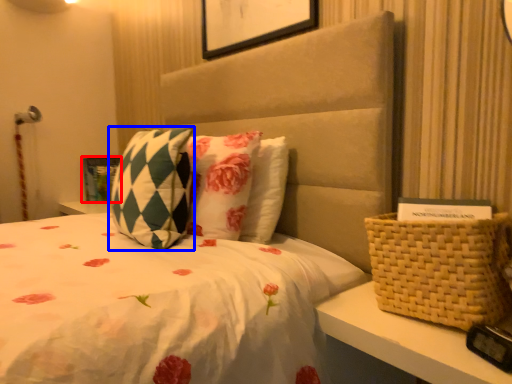
Question: Which of the following is the farthest to the observer, picture frame (highlighted by a red box) or pillow (highlighted by a blue box)?

Choices:
 (A) picture frame
 (B) pillow

Answer: (A)